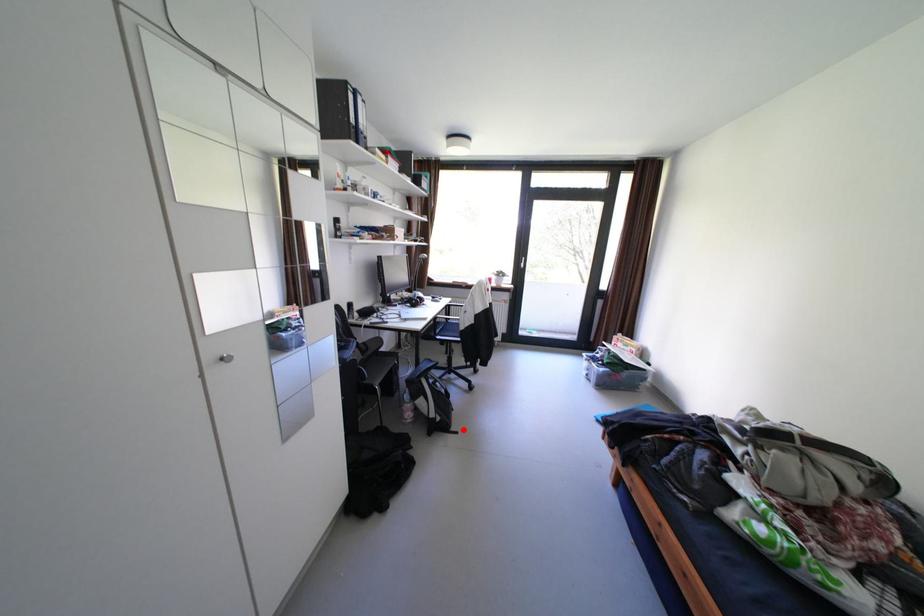
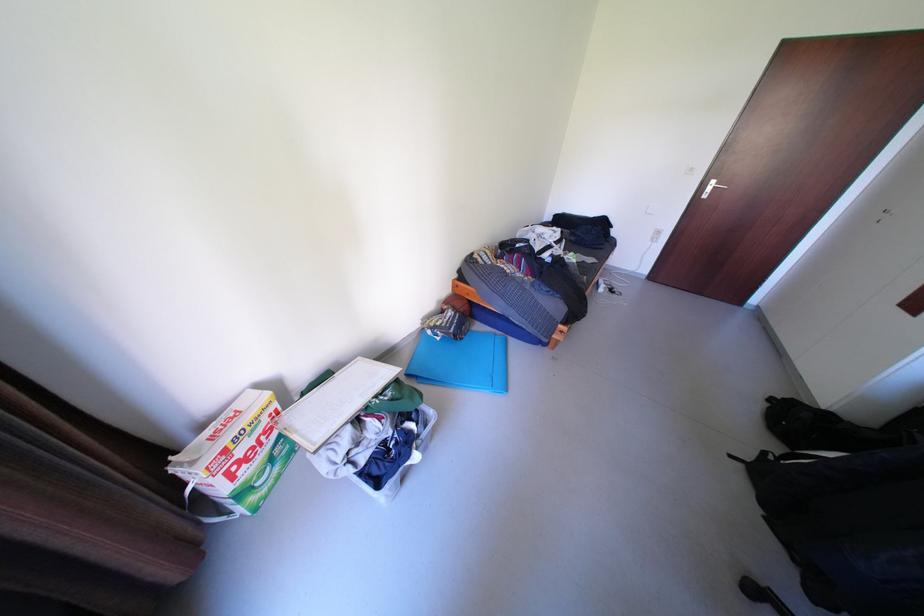
Question: I am providing you with two images of the same scene from different viewpoints. In image1, a red point is highlighted. Considering the same 3D point in image2, which of the following is correct?

Choices:
 (A) It is closer
 (B) It is farther

Answer: (B)